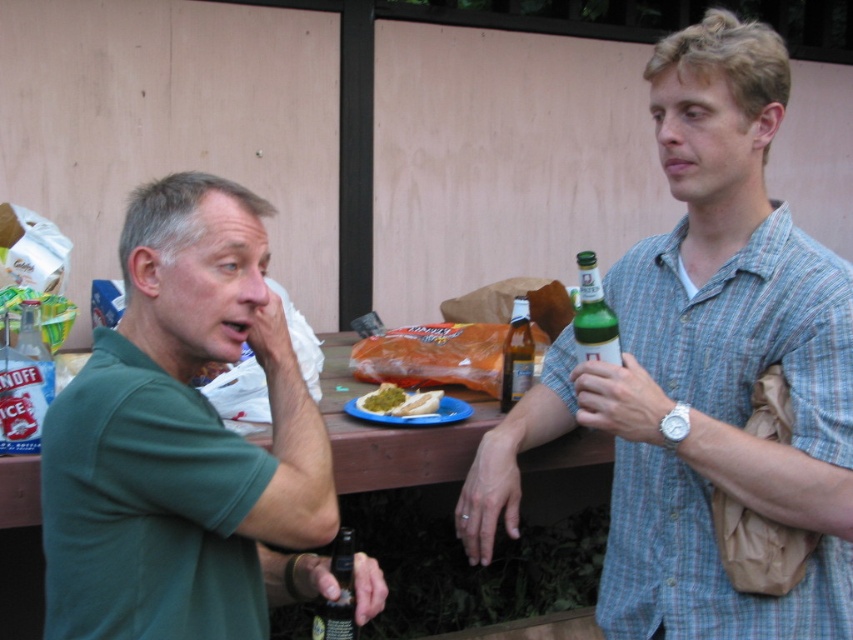
Looking at this image, measure the distance from brown wood table at center to green glass bottle at right.

A distance of 25.05 inches exists between brown wood table at center and green glass bottle at right.

Can you confirm if brown wood table at center is wider than green glass bottle at right?

Indeed, brown wood table at center has a greater width compared to green glass bottle at right.

Does point (490, 408) come behind point (590, 353)?

Yes, point (490, 408) is behind point (590, 353).

The image size is (853, 640). Identify the location of brown wood table at center. (393, 435).

Between brown wood table at center and green mustard spread on bread at center, which one is positioned lower?

green mustard spread on bread at center is lower down.

In the scene shown: Does brown wood table at center appear on the left side of green mustard spread on bread at center?

Correct, you'll find brown wood table at center to the left of green mustard spread on bread at center.

Find the location of a particular element. The image size is (853, 640). brown wood table at center is located at coordinates (393, 435).

Between green matte shirt at left and brown wood table at center, which one is positioned lower?

Positioned lower is brown wood table at center.

Which of these two, green matte shirt at left or brown wood table at center, stands shorter?

Standing shorter between the two is brown wood table at center.

The width and height of the screenshot is (853, 640). Describe the element at coordinates (183, 440) in the screenshot. I see `green matte shirt at left` at that location.

The image size is (853, 640). In order to click on green matte shirt at left in this screenshot , I will do `click(183, 440)`.